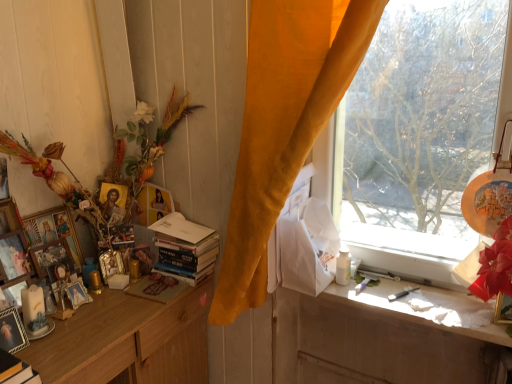
Question: Should I look upward or downward to see wooden picture frame at left, which is the 6th picture frame in right-to-left order?

Choices:
 (A) down
 (B) up

Answer: (A)

Question: Can you confirm if gold leaf picture frame at upper left, positioned as the third picture frame in right-to-left order, is smaller than hardcover books at center?

Choices:
 (A) no
 (B) yes

Answer: (B)

Question: Is gold leaf picture frame at upper left, positioned as the third picture frame in right-to-left order, shorter than hardcover books at center?

Choices:
 (A) yes
 (B) no

Answer: (A)

Question: Is gold leaf picture frame at upper left, which ranks as the 7th picture frame in left-to-right order, wider than hardcover books at center?

Choices:
 (A) yes
 (B) no

Answer: (B)

Question: Are gold leaf picture frame at upper left, positioned as the third picture frame in right-to-left order, and hardcover books at center making contact?

Choices:
 (A) no
 (B) yes

Answer: (A)

Question: Can you confirm if gold leaf picture frame at upper left, which ranks as the 7th picture frame in left-to-right order, is bigger than hardcover books at center?

Choices:
 (A) no
 (B) yes

Answer: (A)

Question: Are gold leaf picture frame at upper left, positioned as the third picture frame in right-to-left order, and hardcover books at center located far from each other?

Choices:
 (A) no
 (B) yes

Answer: (A)

Question: Can you confirm if wooden picture frame at left, which appears as the sixth picture frame when viewed from the left, is smaller than transparent glass window at right?

Choices:
 (A) yes
 (B) no

Answer: (A)

Question: Is wooden picture frame at left, arranged as the fourth picture frame when viewed from the right, to the right of transparent glass window at right from the viewer's perspective?

Choices:
 (A) no
 (B) yes

Answer: (A)

Question: Does wooden picture frame at left, arranged as the fourth picture frame when viewed from the right, have a lesser height compared to transparent glass window at right?

Choices:
 (A) yes
 (B) no

Answer: (A)

Question: Is wooden picture frame at left, which appears as the sixth picture frame when viewed from the left, in front of transparent glass window at right?

Choices:
 (A) no
 (B) yes

Answer: (A)

Question: From the image's perspective, is wooden picture frame at left, arranged as the fourth picture frame when viewed from the right, beneath transparent glass window at right?

Choices:
 (A) yes
 (B) no

Answer: (A)

Question: Is transparent glass window at right completely or partially inside wooden picture frame at left, which appears as the sixth picture frame when viewed from the left?

Choices:
 (A) yes
 (B) no

Answer: (B)

Question: From a real-world perspective, is wooden picture frame at left, the ninth picture frame when ordered from right to left, located higher than white glossy bottle at window?

Choices:
 (A) yes
 (B) no

Answer: (A)